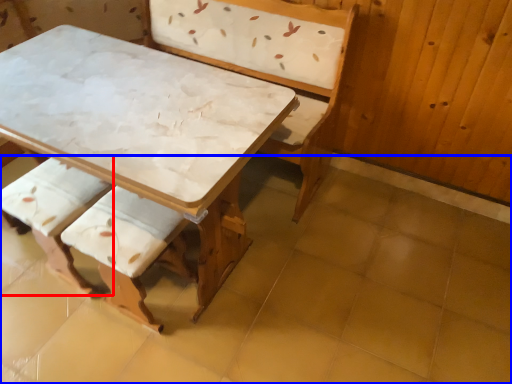
Question: Which of the following is the farthest to the observer, armchair (highlighted by a red box) or tile (highlighted by a blue box)?

Choices:
 (A) armchair
 (B) tile

Answer: (A)